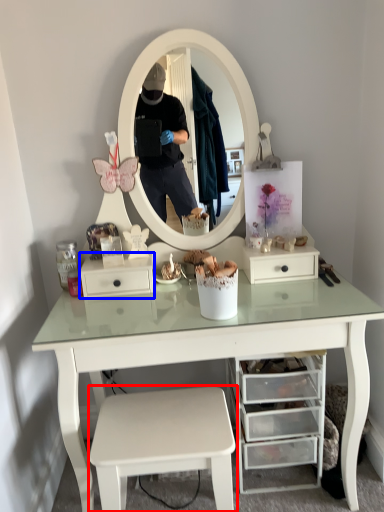
Question: Which object is further to the camera taking this photo, stool (highlighted by a red box) or drawer (highlighted by a blue box)?

Choices:
 (A) stool
 (B) drawer

Answer: (B)